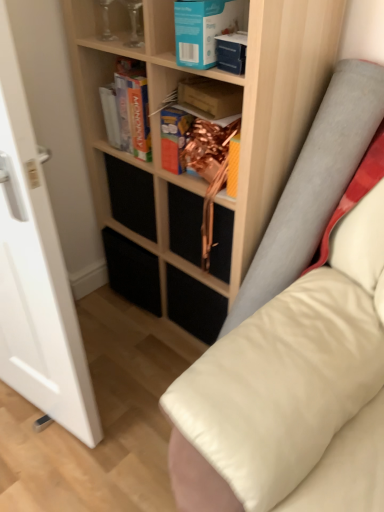
Identify the location of vacant space to the right of transparent glass door at left. The height and width of the screenshot is (512, 384). (133, 393).